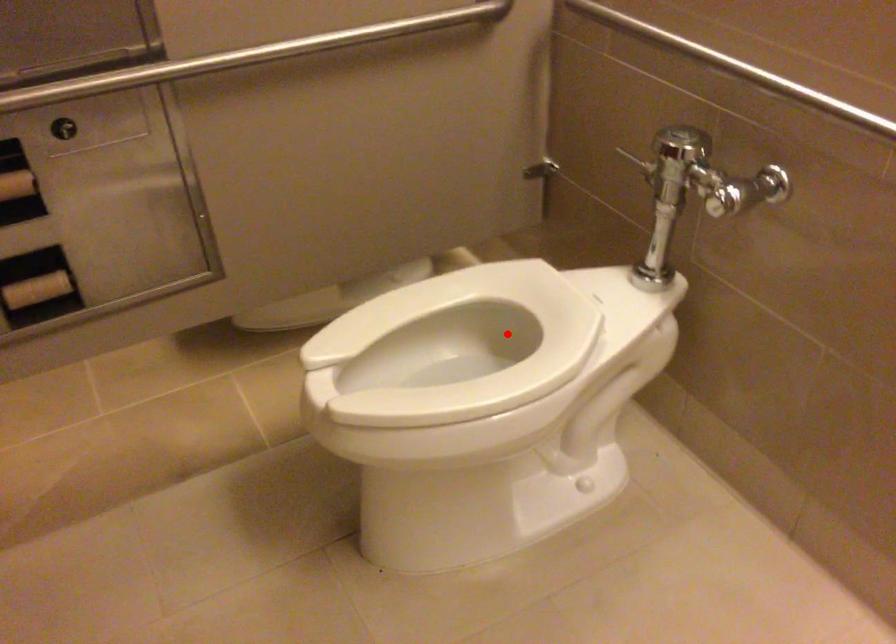
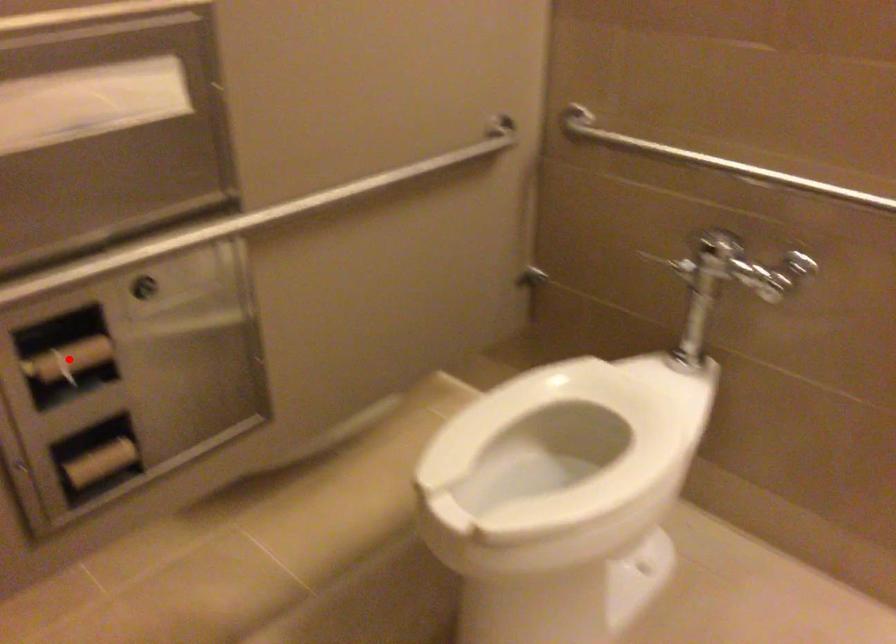
I am providing you with two images of the same scene from different viewpoints. A red point is marked on the first image and another point is marked on the second image. Are the points marked in image1 and image2 representing the same 3D position?

No